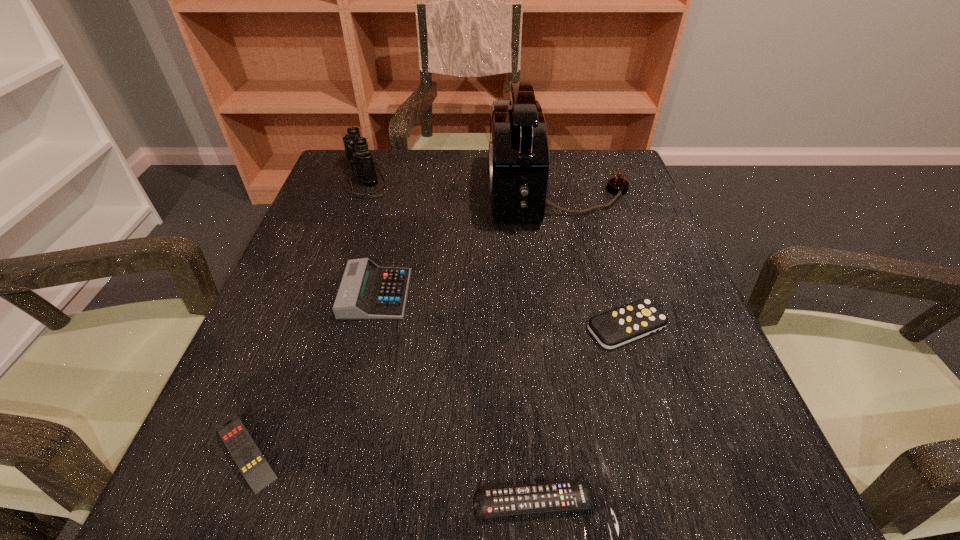
This screenshot has height=540, width=960. I want to click on free region located on the right of the binoculars, so click(478, 177).

In order to click on free spot located 0.280m on the back of the third tallest object in this screenshot , I will do `click(399, 192)`.

The image size is (960, 540). Identify the location of free space located on the back of the farthest remote control. (598, 236).

Locate an element on the screen. This screenshot has width=960, height=540. free spot located on the back of the leftmost remote control is located at coordinates (293, 329).

At what (x,y) coordinates should I click in order to perform the action: click on vacant space located 0.130m on the left of the second remote control from right to left. Please return your answer as a coordinate pair (x, y). This screenshot has height=540, width=960. Looking at the image, I should click on (372, 502).

The height and width of the screenshot is (540, 960). Find the location of `radio receiver at the far edge`. radio receiver at the far edge is located at coordinates (519, 157).

Where is `binoculars at the far edge`? This screenshot has height=540, width=960. binoculars at the far edge is located at coordinates (356, 147).

The image size is (960, 540). I want to click on binoculars located in the left edge section of the desktop, so click(x=356, y=147).

This screenshot has height=540, width=960. Find the location of `calculator that is at the left edge`. calculator that is at the left edge is located at coordinates (367, 291).

What are the coordinates of `remote control located at the left edge` in the screenshot? It's located at (246, 454).